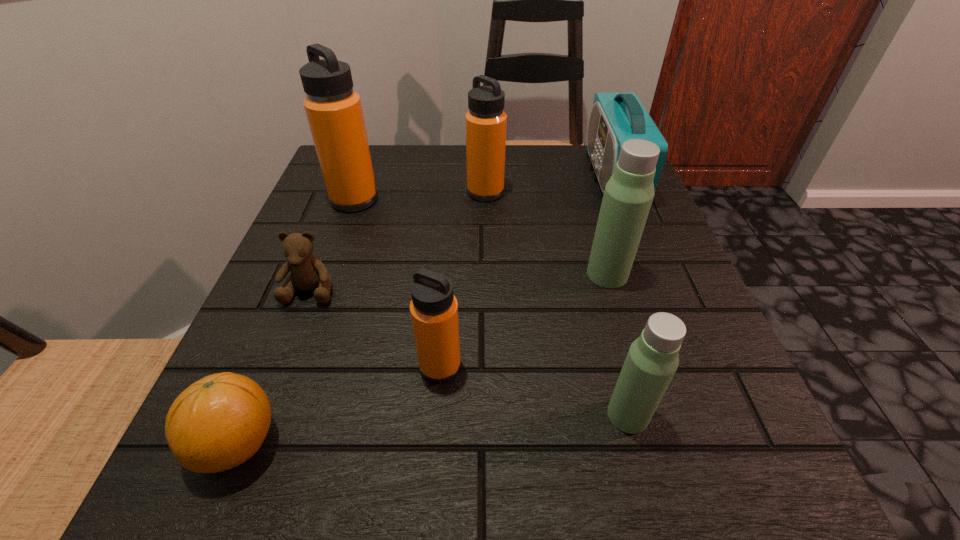
Where is `the tallest object`? the tallest object is located at coordinates (615, 118).

The image size is (960, 540). I want to click on light radio receiver, so click(x=615, y=118).

This screenshot has height=540, width=960. Identify the location of the leftmost thermos bottle. (333, 109).

Locate an element on the screen. Image resolution: width=960 pixels, height=540 pixels. the leftmost orange thermos bottle is located at coordinates (333, 109).

You are a GUI agent. You are given a task and a screenshot of the screen. Output one action in this format:
    pyautogui.click(x=<x>, y=<y>)
    Task: Click on the second smallest orange thermos bottle
    Image resolution: width=960 pixels, height=540 pixels.
    Given the screenshot: What is the action you would take?
    pyautogui.click(x=486, y=122)

Locate an element on the screen. the farther light thermos bottle is located at coordinates (628, 195).

Locate an element on the screen. The width and height of the screenshot is (960, 540). the bigger light thermos bottle is located at coordinates (628, 195).

Image resolution: width=960 pixels, height=540 pixels. I want to click on the smaller light thermos bottle, so tap(652, 360).

The height and width of the screenshot is (540, 960). I want to click on the nearer light thermos bottle, so click(x=652, y=360).

The image size is (960, 540). Find the location of `the smallest orange thermos bottle`. the smallest orange thermos bottle is located at coordinates (434, 309).